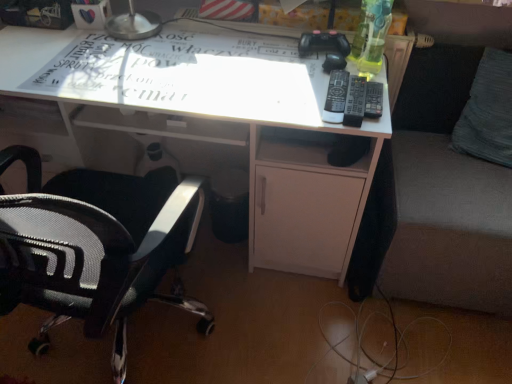
In order to click on vacant area situated to the left side of black plastic remote at upper right, which ranks as the 1th remote in left-to-right order in this screenshot , I will do [x=282, y=91].